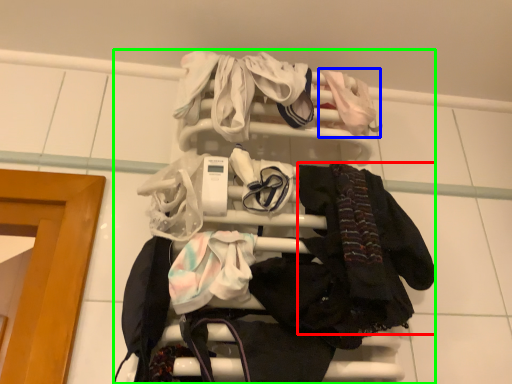
Question: Which object is the farthest from clothing (highlighted by a red box)? Choose among these: baby clothe (highlighted by a blue box) or bunk bed (highlighted by a green box).

Choices:
 (A) baby clothe
 (B) bunk bed

Answer: (A)